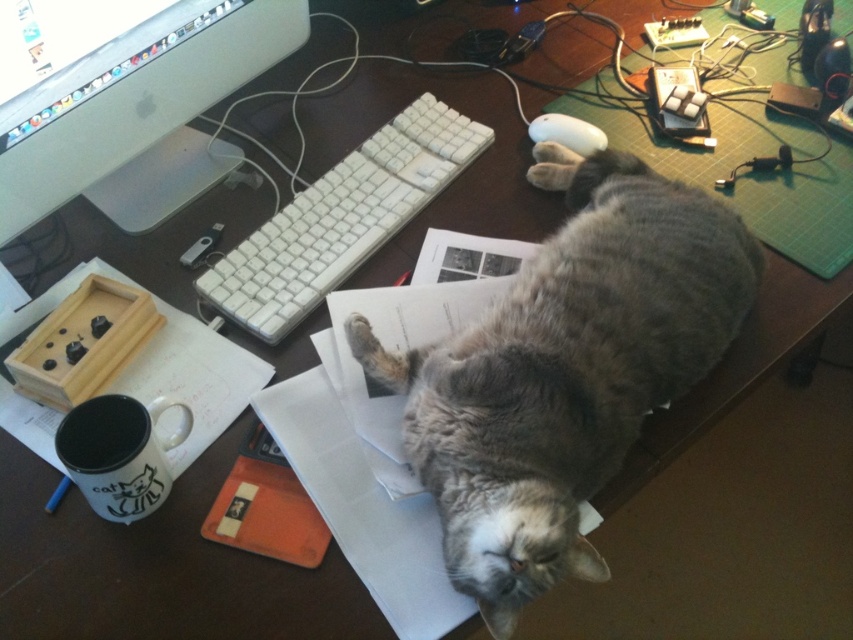
Which is more to the right, white plastic keyboard at center or white ceramic mug at lower left?

Positioned to the right is white plastic keyboard at center.

Can you confirm if white plastic keyboard at center is wider than white ceramic mug at lower left?

Indeed, white plastic keyboard at center has a greater width compared to white ceramic mug at lower left.

Find the location of a particular element. The image size is (853, 640). white plastic keyboard at center is located at coordinates (341, 218).

What do you see at coordinates (142, 108) in the screenshot? I see `sleek silver monitor at upper left` at bounding box center [142, 108].

Between point (248, 42) and point (561, 132), which one is positioned behind?

Positioned behind is point (561, 132).

At what (x,y) coordinates should I click in order to perform the action: click on sleek silver monitor at upper left. Please return your answer as a coordinate pair (x, y). This screenshot has width=853, height=640. Looking at the image, I should click on (142, 108).

Does sleek silver monitor at upper left come behind white plastic keyboard at center?

No, it is in front of white plastic keyboard at center.

Between point (213, 33) and point (289, 241), which one is positioned behind?

The point (289, 241) is more distant.

The height and width of the screenshot is (640, 853). Find the location of `sleek silver monitor at upper left`. sleek silver monitor at upper left is located at coordinates click(x=142, y=108).